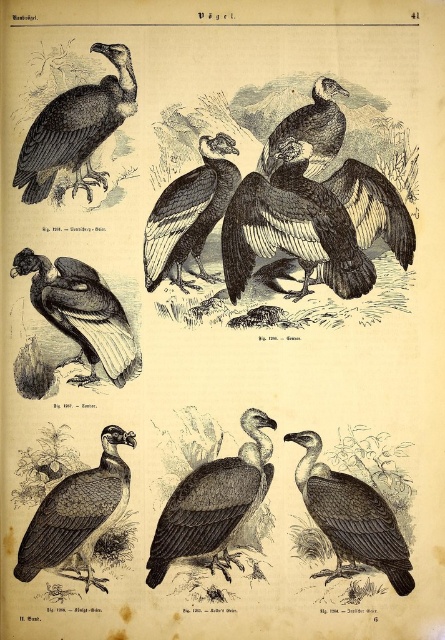
Does point (368, 490) come farther from viewer compared to point (57, 259)?

No, (368, 490) is in front of (57, 259).

You are a GUI agent. You are given a task and a screenshot of the screen. Output one action in this format:
    pyautogui.click(x=<x>, y=<y>)
    Task: Click on the dark gray feathers at center
    The height and width of the screenshot is (640, 445).
    Given the screenshot: What is the action you would take?
    pyautogui.click(x=351, y=518)

At what (x,y) coordinates should I click in order to perform the action: click on dark gray feathers at center. Please return your answer as a coordinate pair (x, y). This screenshot has width=445, height=640. Looking at the image, I should click on (351, 518).

Which of these two, gray feathered vulture at center or black feathered vulture at center, stands taller?

With more height is black feathered vulture at center.

Who is more distant from viewer, [150,588] or [176,252]?

Point [150,588]

Find the location of a particular element. Image resolution: width=445 pixels, height=640 pixels. gray feathered vulture at center is located at coordinates (214, 502).

Does gray feathered vulture at center come behind dark gray feathered vulture at center?

No, it is in front of dark gray feathered vulture at center.

Who is more forward, (177, 493) or (120, 429)?

Point (177, 493)

Between point (146, 563) and point (110, 442), which one is positioned behind?

Positioned behind is point (110, 442).

This screenshot has height=640, width=445. In order to click on gray feathered vulture at center in this screenshot , I will do `click(214, 502)`.